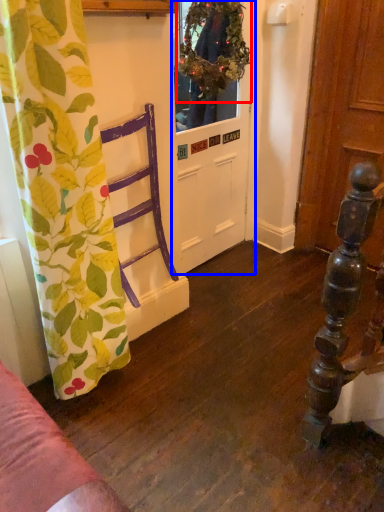
Question: Among these objects, which one is nearest to the camera, floral arrangement (highlighted by a red box) or door (highlighted by a blue box)?

Choices:
 (A) floral arrangement
 (B) door

Answer: (A)